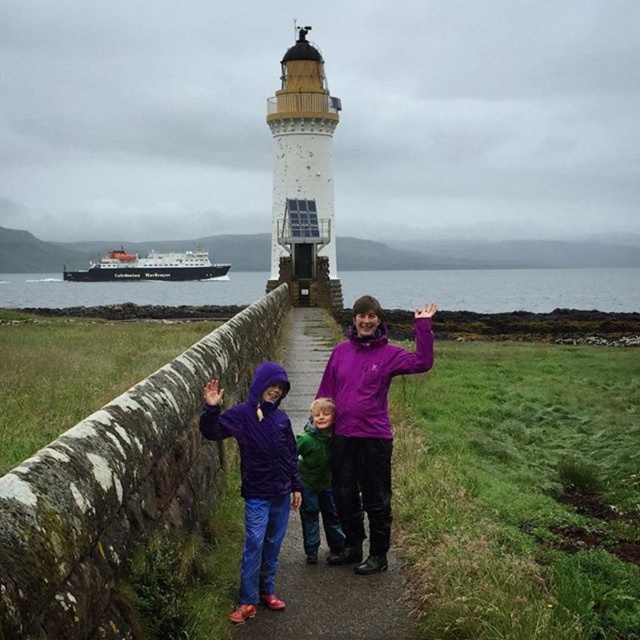
You are standing on the pathway and want to take a photo of the green matte jacket at center and the clear water at center. Which object should you focus on first if you want both to be in focus?

You should focus on the green matte jacket at center first because it is closer to you than the clear water at center, which is further away. This way, both objects will be in focus.